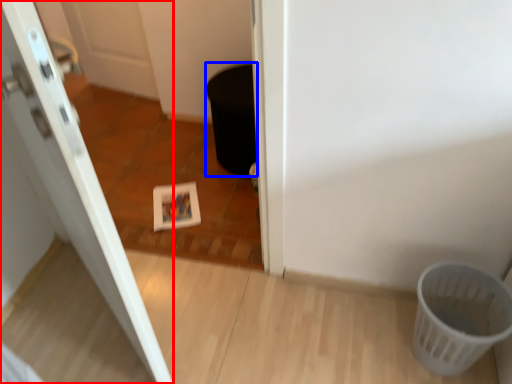
Question: Which point is further to the camera, door (highlighted by a red box) or potty (highlighted by a blue box)?

Choices:
 (A) door
 (B) potty

Answer: (B)